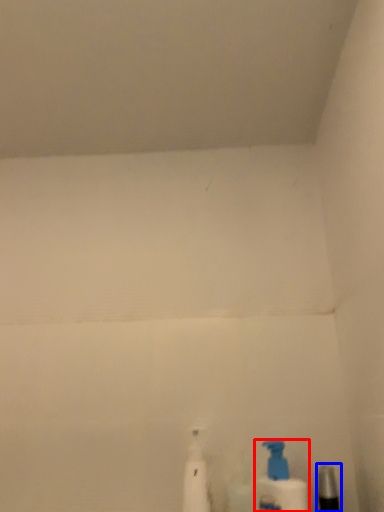
Question: Which of the following is the closest to the observer, bottle (highlighted by a red box) or toiletry (highlighted by a blue box)?

Choices:
 (A) bottle
 (B) toiletry

Answer: (B)